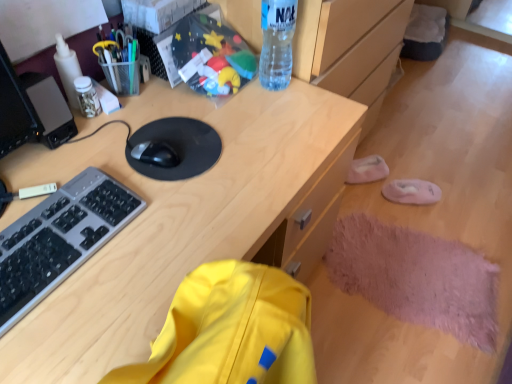
Where is `unoccupied area in front of metallic pen holder at upper left, the second stationery viewed from the left`? Image resolution: width=512 pixels, height=384 pixels. unoccupied area in front of metallic pen holder at upper left, the second stationery viewed from the left is located at coordinates (123, 129).